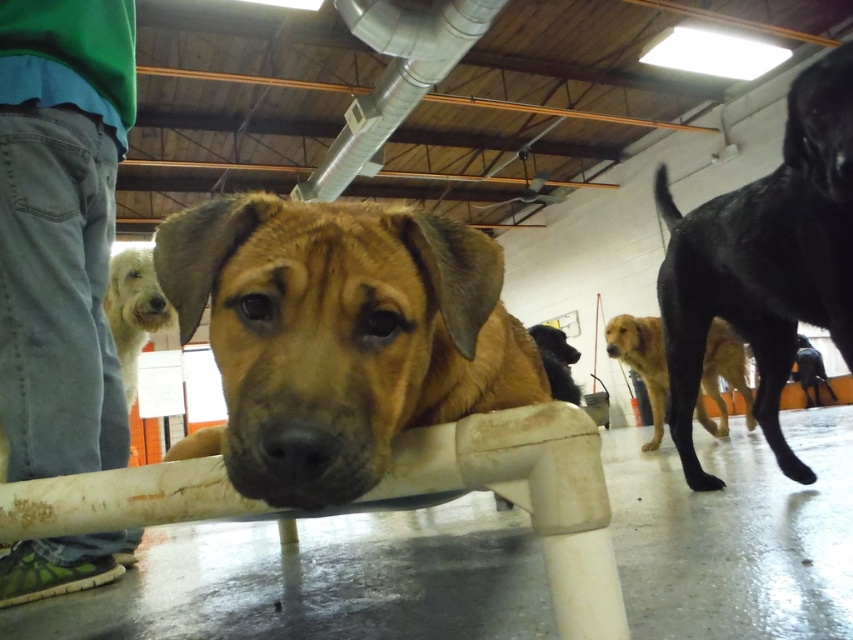
Is fuzzy white dog at upper left thinner than brown matte dog at center?

Yes.

How far apart are fuzzy white dog at upper left and brown matte dog at center?

fuzzy white dog at upper left is 1.57 meters from brown matte dog at center.

Between point (171, 323) and point (560, 352), which one is positioned in front?

Point (171, 323) is more forward.

This screenshot has width=853, height=640. I want to click on fuzzy white dog at upper left, so click(134, 308).

Is black glossy dog at upper right shorter than golden brown fur at center?

In fact, black glossy dog at upper right may be taller than golden brown fur at center.

Between black glossy dog at upper right and golden brown fur at center, which one appears on the left side from the viewer's perspective?

black glossy dog at upper right

Who is more forward, [802,474] or [608,344]?

Positioned in front is point [802,474].

Identify the location of black glossy dog at upper right. (764, 260).

Can you confirm if brown furry dog at center is smaller than brown matte dog at center?

Yes, brown furry dog at center is smaller than brown matte dog at center.

Who is more forward, [195,308] or [561,371]?

Point [195,308]

Which is in front, point (241, 320) or point (535, 330)?

Positioned in front is point (241, 320).

This screenshot has width=853, height=640. Identify the location of brown furry dog at center. (338, 336).